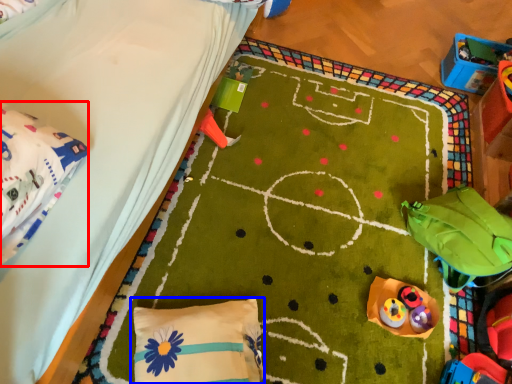
Question: Which object appears farthest to the camera in this image, material (highlighted by a red box) or pillow (highlighted by a blue box)?

Choices:
 (A) material
 (B) pillow

Answer: (B)